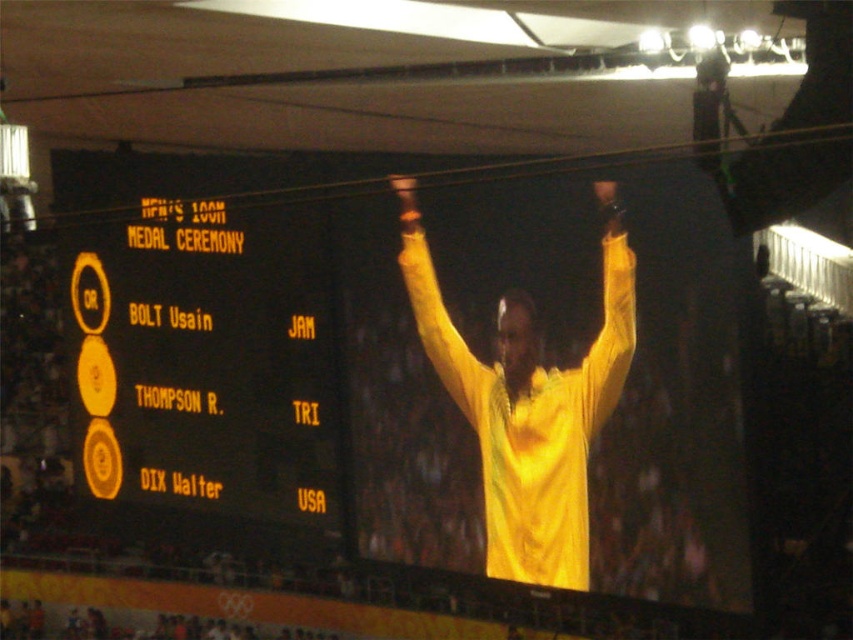
Is point (579, 486) farther from viewer compared to point (599, 182)?

That is True.

Does point (419, 333) come farther from viewer compared to point (625, 291)?

That is True.

Image resolution: width=853 pixels, height=640 pixels. In order to click on yellow fabric at center in this screenshot , I will do `click(529, 403)`.

Is yellow matte scoreboard at upper center to the left of yellow fabric arm at center from the viewer's perspective?

Correct, you'll find yellow matte scoreboard at upper center to the left of yellow fabric arm at center.

Does point (218, 449) come behind point (469, 419)?

Yes, point (218, 449) is farther from viewer.

Which is behind, point (257, 435) or point (469, 413)?

The point (257, 435) is more distant.

At what (x,y) coordinates should I click in order to perform the action: click on yellow matte scoreboard at upper center. Please return your answer as a coordinate pair (x, y). The height and width of the screenshot is (640, 853). Looking at the image, I should click on (202, 346).

Can you confirm if yellow fabric arm at center is positioned above yellow fabric arm at upper center?

Yes.

Can you confirm if yellow fabric arm at center is shorter than yellow fabric arm at upper center?

Yes, yellow fabric arm at center is shorter than yellow fabric arm at upper center.

Does point (461, 392) come farther from viewer compared to point (614, 353)?

That is True.

What are the coordinates of `yellow fabric arm at center` in the screenshot? It's located at (437, 314).